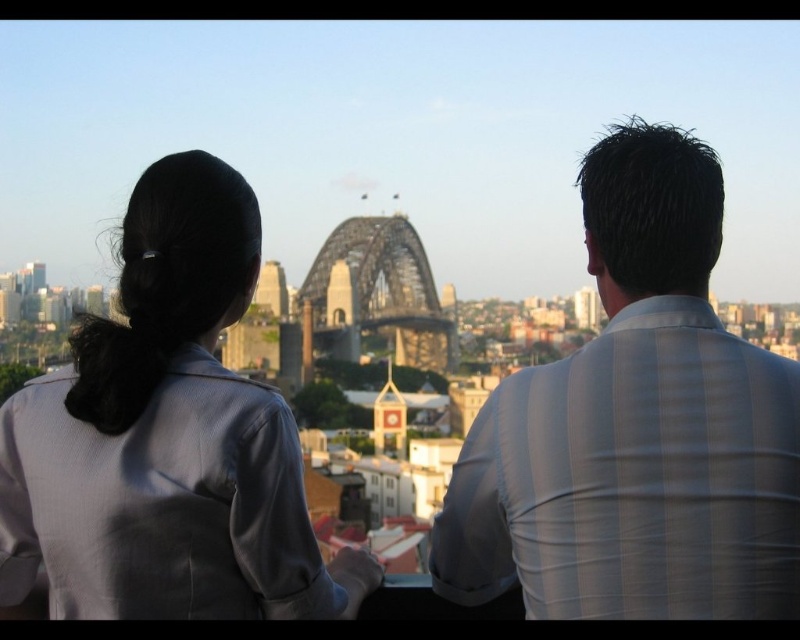
You are taking a photo of the two people in the scene. You want to focus on the person closer to the camera. Which of the two points, point (662, 602) or point (132, 512), should you focus on?

Point (662, 602) is further to the camera than point (132, 512). Therefore, to focus on the person closer to the camera, you should focus on point (132, 512).

In the scene shown: You are a photographer trying to capture the metallic bridge at center in your shot. There is a person wearing a white striped shirt at upper right blocking your view. Can you move the person to the left to get a clear shot of the bridge?

The white striped shirt at upper right is to the right of the metallic bridge at center, so moving the person to the left would position them away from the bridge, allowing you to capture the metallic bridge at center without obstruction.

You are a photographer trying to capture a candid shot of both the white striped shirt at upper right and the matte gray blazer at left in the same frame. Based on their positions, which subject should you focus on first to ensure both are in the shot?

The white striped shirt at upper right is much taller than the matte gray blazer at left, so focusing on the white striped shirt at upper right first will allow you to adjust the frame to include both subjects.